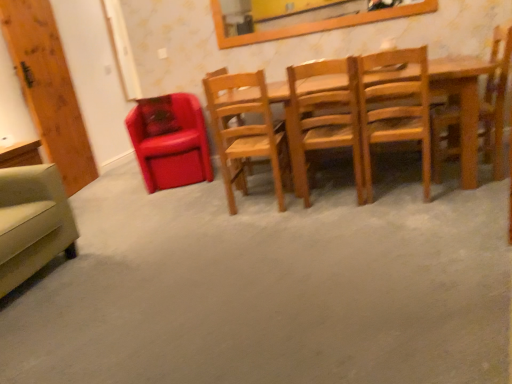
Identify the location of free spot in front of wooden chair at center, which is the fourth chair from left to right. Image resolution: width=512 pixels, height=384 pixels. (341, 215).